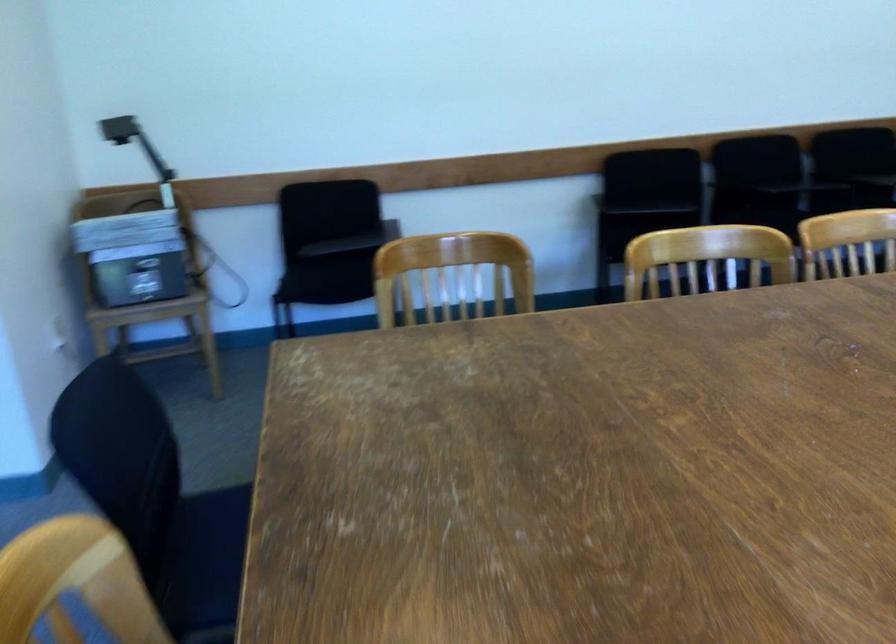
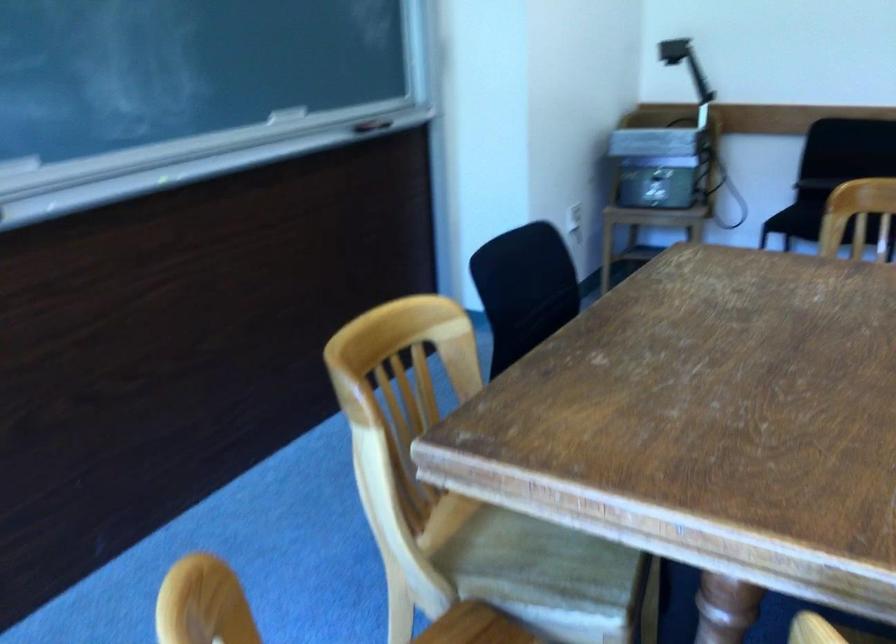
The point at (153, 263) is marked in the first image. Where is the corresponding point in the second image?

(659, 166)